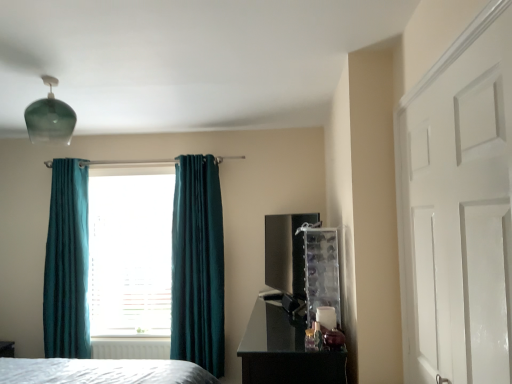
Describe the element at coordinates (130, 251) in the screenshot. The height and width of the screenshot is (384, 512). I see `teal fabric curtain at center` at that location.

What do you see at coordinates (130, 348) in the screenshot?
I see `white plastic radiator at lower center` at bounding box center [130, 348].

The image size is (512, 384). What do you see at coordinates (50, 118) in the screenshot?
I see `green glass light fixture at upper left` at bounding box center [50, 118].

Describe the element at coordinates (458, 208) in the screenshot. I see `white painted wood door at right` at that location.

Find the location of `teal velvet curtain at center, the 2th curtain positioned from the left`. teal velvet curtain at center, the 2th curtain positioned from the left is located at coordinates (198, 265).

In order to face glossy black dresser at lower right, should I rotate leftwards or rightwards?

To face it directly, rotate right by 5.190 degrees.

Where is `teal fabric curtain at center`? teal fabric curtain at center is located at coordinates (130, 251).

Is the depth of white painted wood door at right less than that of glossy black dresser at lower right?

Yes, it is.

Considering the sizes of objects white painted wood door at right and glossy black dresser at lower right in the image provided, who is shorter, white painted wood door at right or glossy black dresser at lower right?

glossy black dresser at lower right is shorter.

From a real-world perspective, is white painted wood door at right positioned under glossy black dresser at lower right based on gravity?

Actually, white painted wood door at right is physically above glossy black dresser at lower right in the real world.

Is point (459, 363) farther from viewer compared to point (314, 356)?

That is False.

Is white plastic radiator at lower center with teal fabric curtain at center?

No, white plastic radiator at lower center is not beside teal fabric curtain at center.

Which is correct: white plastic radiator at lower center is inside teal fabric curtain at center, or outside of it?

white plastic radiator at lower center is not enclosed by teal fabric curtain at center.

Is white plastic radiator at lower center shorter than teal fabric curtain at center?

Yes.

Does white plastic radiator at lower center have a larger size compared to teal fabric curtain at center?

No.

From a real-world perspective, is white painted wood door at right physically located above or below white plastic radiator at lower center?

white painted wood door at right is above white plastic radiator at lower center.

From the image's perspective, which object appears higher, white painted wood door at right or white plastic radiator at lower center?

white painted wood door at right is shown above in the image.

Visually, is white painted wood door at right positioned to the left or to the right of white plastic radiator at lower center?

→ white painted wood door at right is positioned on white plastic radiator at lower center's right side.

From the image's perspective, count 2nd curtains upward from the white plastic radiator at lower center and point to it. Please provide its 2D coordinates.

[(67, 263)]

In terms of height, does teal velvet curtain at left, the first curtain viewed from the left, look taller or shorter compared to white plastic radiator at lower center?

Considering their sizes, teal velvet curtain at left, the first curtain viewed from the left, has more height than white plastic radiator at lower center.

Considering their positions, is teal velvet curtain at left, the first curtain viewed from the left, located in front of or behind white plastic radiator at lower center?

Clearly, teal velvet curtain at left, the first curtain viewed from the left, is in front of white plastic radiator at lower center.

Can you tell me how much teal velvet curtain at left, positioned as the second curtain in right-to-left order, and white plastic radiator at lower center differ in facing direction?

There is a 2.64-degree angle between the facing directions of teal velvet curtain at left, positioned as the second curtain in right-to-left order, and white plastic radiator at lower center.

Would you consider black glossy tv at center-right to be distant from glossy black dresser at lower right?

No.

Consider the image. Can we say black glossy tv at center-right lies outside glossy black dresser at lower right?

Yes, black glossy tv at center-right is not within glossy black dresser at lower right.

Is point (281, 219) more distant than point (254, 329)?

Yes, point (281, 219) is farther from viewer.

Looking at the image, does black glossy tv at center-right seem bigger or smaller compared to glossy black dresser at lower right?

Considering their sizes, black glossy tv at center-right takes up less space than glossy black dresser at lower right.

Which object is positioned more to the left, teal velvet curtain at left, the first curtain viewed from the left, or black glossy tv at center-right?

teal velvet curtain at left, the first curtain viewed from the left.

Is teal velvet curtain at left, positioned as the second curtain in right-to-left order, shorter than black glossy tv at center-right?

In fact, teal velvet curtain at left, positioned as the second curtain in right-to-left order, may be taller than black glossy tv at center-right.

Does teal velvet curtain at left, positioned as the second curtain in right-to-left order, touch black glossy tv at center-right?

No, teal velvet curtain at left, positioned as the second curtain in right-to-left order, is not touching black glossy tv at center-right.

Which of these two, teal velvet curtain at left, the first curtain viewed from the left, or black glossy tv at center-right, is bigger?

teal velvet curtain at left, the first curtain viewed from the left.

Is black glossy tv at center-right looking in the opposite direction of teal velvet curtain at center, the first curtain when ordered from right to left?

black glossy tv at center-right does not have its back to teal velvet curtain at center, the first curtain when ordered from right to left.

Which object is more forward, black glossy tv at center-right or teal velvet curtain at center, the 2th curtain positioned from the left?

black glossy tv at center-right is closer to the camera.

From a real-world perspective, which is physically below, black glossy tv at center-right or teal velvet curtain at center, the first curtain when ordered from right to left?

In real-world perspective, teal velvet curtain at center, the first curtain when ordered from right to left, is lower.

Is black glossy tv at center-right far from teal velvet curtain at center, the first curtain when ordered from right to left?

No, black glossy tv at center-right is not far from teal velvet curtain at center, the first curtain when ordered from right to left.

You are a GUI agent. You are given a task and a screenshot of the screen. Output one action in this format:
    pyautogui.click(x=<x>, y=<y>)
    Task: Click on the door in front of the glossy black dresser at lower right
    
    Given the screenshot: What is the action you would take?
    pyautogui.click(x=458, y=208)

You are a GUI agent. You are given a task and a screenshot of the screen. Output one action in this format:
    pyautogui.click(x=<x>, y=<y>)
    Task: Click on the window located on the left of white plastic radiator at lower center
    The width and height of the screenshot is (512, 384).
    Given the screenshot: What is the action you would take?
    pyautogui.click(x=130, y=251)

Looking at the image, which one is located closer to teal fabric curtain at center, green glass light fixture at upper left or teal velvet curtain at center, the 2th curtain positioned from the left?

teal velvet curtain at center, the 2th curtain positioned from the left, is closer to teal fabric curtain at center.

Considering their positions, is white painted wood door at right positioned closer to teal fabric curtain at center than white plastic radiator at lower center?

Based on the image, white plastic radiator at lower center appears to be nearer to teal fabric curtain at center.

Considering their positions, is teal fabric curtain at center positioned further to black glossy tv at center-right than teal velvet curtain at center, the first curtain when ordered from right to left?

Among the two, teal fabric curtain at center is located further to black glossy tv at center-right.

From the picture: When comparing their distances from glossy black dresser at lower right, does green glass light fixture at upper left or teal fabric curtain at center seem further?

green glass light fixture at upper left.

In the scene shown: Considering their positions, is teal fabric curtain at center positioned closer to teal velvet curtain at left, positioned as the second curtain in right-to-left order, than glossy black dresser at lower right?

teal fabric curtain at center is closer to teal velvet curtain at left, positioned as the second curtain in right-to-left order.

Which object lies further to the anchor point black glossy tv at center-right, teal velvet curtain at center, the first curtain when ordered from right to left, or green glass light fixture at upper left?

green glass light fixture at upper left is further to black glossy tv at center-right.

In the scene shown: When comparing their distances from teal velvet curtain at left, the first curtain viewed from the left, does black glossy tv at center-right or white painted wood door at right seem closer?

Among the two, black glossy tv at center-right is located nearer to teal velvet curtain at left, the first curtain viewed from the left.

Which object lies further to the anchor point black glossy tv at center-right, white plastic radiator at lower center or teal velvet curtain at center, the first curtain when ordered from right to left?

white plastic radiator at lower center is positioned further to the anchor black glossy tv at center-right.

You are a GUI agent. You are given a task and a screenshot of the screen. Output one action in this format:
    pyautogui.click(x=<x>, y=<y>)
    Task: Click on the radiator between teal velvet curtain at left, positioned as the second curtain in right-to-left order, and teal velvet curtain at center, the 2th curtain positioned from the left
    The width and height of the screenshot is (512, 384).
    Given the screenshot: What is the action you would take?
    pyautogui.click(x=130, y=348)

Locate an element on the screen. This screenshot has height=384, width=512. window between green glass light fixture at upper left and white plastic radiator at lower center vertically is located at coordinates (130, 251).

I want to click on dresser between white painted wood door at right and white plastic radiator at lower center from front to back, so (x=285, y=351).

I want to click on light fixture between white painted wood door at right and teal velvet curtain at center, the 2th curtain positioned from the left, along the z-axis, so click(50, 118).